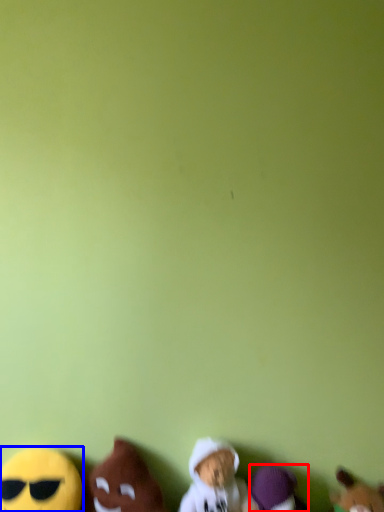
Question: Which of the following is the closest to the observer, toy (highlighted by a red box) or toy (highlighted by a blue box)?

Choices:
 (A) toy
 (B) toy

Answer: (B)